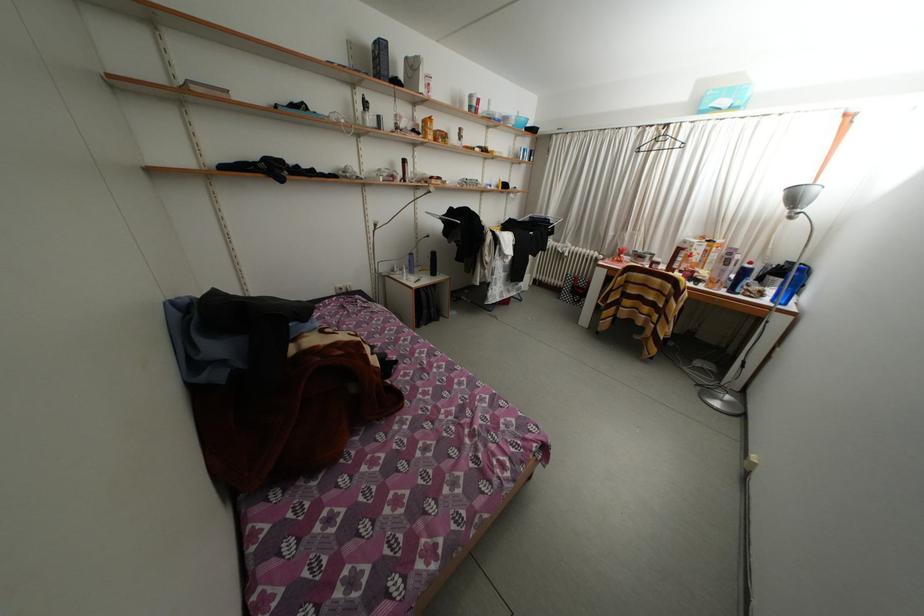
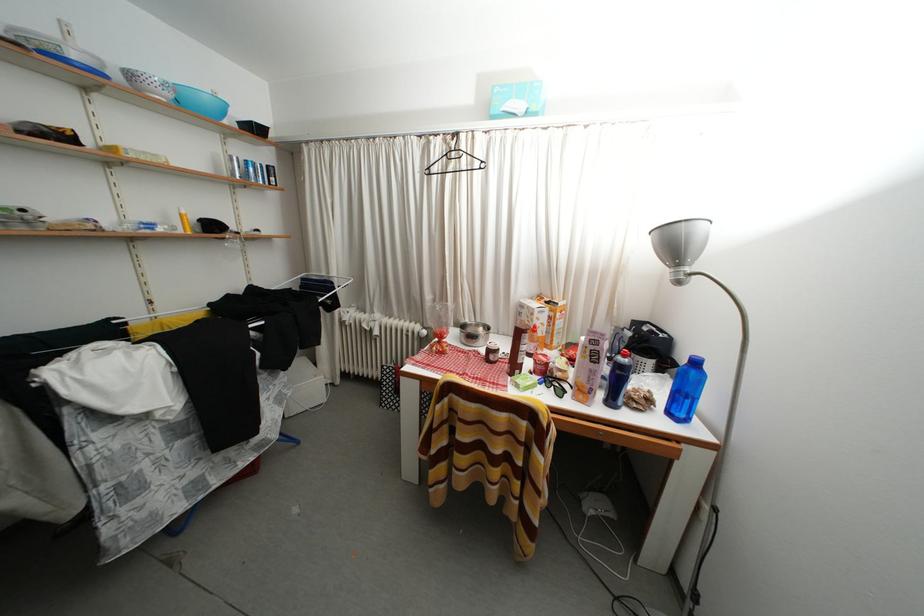
In the second image, find the point that corresponds to point (739, 296) in the first image.

(618, 408)